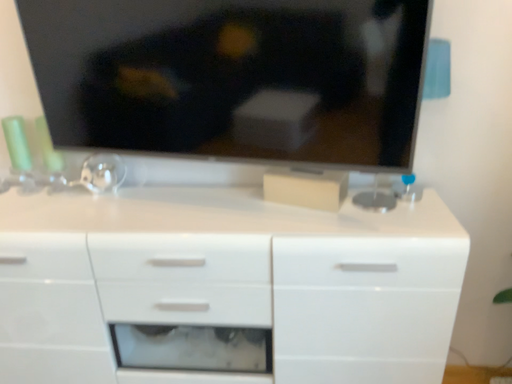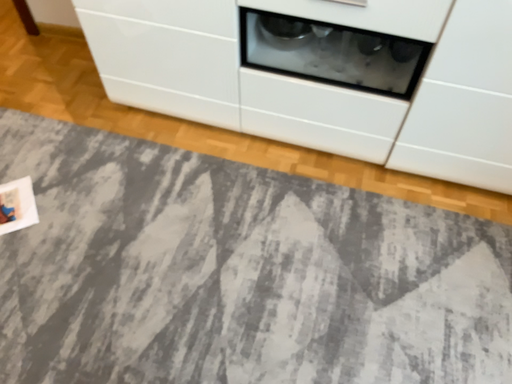
Question: How did the camera likely rotate when shooting the video?

Choices:
 (A) rotated downward
 (B) rotated upward

Answer: (A)